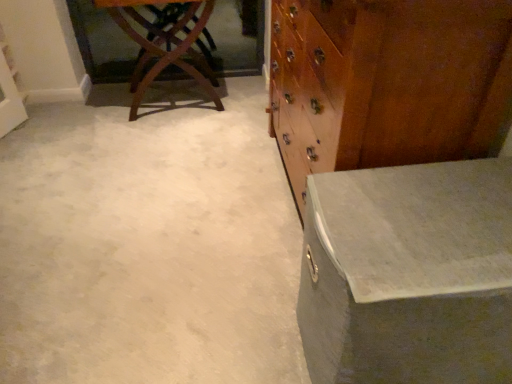
What is the approximate height of mahogany wood table at upper left, which is the first table in top-to-bottom order?

It is 68.47 centimeters.

At what (x,y) coordinates should I click in order to perform the action: click on wooden chest of drawers at right. Please return your answer as a coordinate pair (x, y). The image size is (512, 384). Looking at the image, I should click on (386, 82).

Describe the element at coordinates (148, 243) in the screenshot. I see `white concrete at center` at that location.

The width and height of the screenshot is (512, 384). What are the coordinates of `matte gray trunk at right, arranged as the 2th table when viewed from the back` in the screenshot? It's located at (408, 274).

At what (x,y) coordinates should I click in order to perform the action: click on mahogany wood table at upper left, which is the first table in top-to-bottom order. Please return your answer as a coordinate pair (x, y). Looking at the image, I should click on (162, 44).

From the image's perspective, is mahogany wood table at upper left, acting as the second table starting from the bottom, positioned above or below white concrete at center?

mahogany wood table at upper left, acting as the second table starting from the bottom, is above white concrete at center.

Is mahogany wood table at upper left, which appears as the second table when viewed from the front, next to white concrete at center?

No, mahogany wood table at upper left, which appears as the second table when viewed from the front, is not next to white concrete at center.

Is mahogany wood table at upper left, which ranks as the 1th table in left-to-right order, wider or thinner than white concrete at center?

Considering their sizes, mahogany wood table at upper left, which ranks as the 1th table in left-to-right order, looks slimmer than white concrete at center.

From a real-world perspective, is mahogany wood table at upper left, which is the first table in top-to-bottom order, over white concrete at center?

Correct, in the physical world, mahogany wood table at upper left, which is the first table in top-to-bottom order, is higher than white concrete at center.

Which object is positioned more to the left, wooden chest of drawers at right or matte gray trunk at right, arranged as the 2th table when viewed from the back?

wooden chest of drawers at right.

From their relative heights in the image, would you say wooden chest of drawers at right is taller or shorter than matte gray trunk at right, placed as the 2th table when sorted from top to bottom?

In the image, wooden chest of drawers at right appears to be taller than matte gray trunk at right, placed as the 2th table when sorted from top to bottom.

Looking at this image, can you confirm if wooden chest of drawers at right is smaller than matte gray trunk at right, arranged as the 2th table when viewed from the back?

No.

Looking at their sizes, would you say wooden chest of drawers at right is wider or thinner than matte gray trunk at right, which appears as the second table when viewed from the left?

In the image, wooden chest of drawers at right appears to be more narrow than matte gray trunk at right, which appears as the second table when viewed from the left.

Which is in front, point (428, 230) or point (189, 348)?

The point (428, 230) is closer to the camera.

From a real-world perspective, is matte gray trunk at right, arranged as the first table when ordered from the bottom, beneath white concrete at center?

Incorrect, from a real-world perspective, matte gray trunk at right, arranged as the first table when ordered from the bottom, is higher than white concrete at center.

Between matte gray trunk at right, arranged as the first table when ordered from the bottom, and white concrete at center, which one has larger width?

With larger width is white concrete at center.

Considering the relative positions of matte gray trunk at right, arranged as the 2th table when viewed from the back, and white concrete at center in the image provided, is matte gray trunk at right, arranged as the 2th table when viewed from the back, to the left of white concrete at center from the viewer's perspective?

No.

Considering the relative positions of wooden chest of drawers at right and white concrete at center in the image provided, is wooden chest of drawers at right behind white concrete at center?

No, wooden chest of drawers at right is in front of white concrete at center.

What's the angular difference between wooden chest of drawers at right and white concrete at center's facing directions?

The facing directions of wooden chest of drawers at right and white concrete at center are 90.2 degrees apart.

Consider the image. Which is nearer, (402, 138) or (284, 294)?

The point (402, 138) is closer to the camera.

From the image's perspective, which is below, wooden chest of drawers at right or white concrete at center?

From the image's view, white concrete at center is below.

Considering the sizes of matte gray trunk at right, arranged as the first table when ordered from the bottom, and mahogany wood table at upper left, the 2th table when ordered from right to left, in the image, is matte gray trunk at right, arranged as the first table when ordered from the bottom, wider or thinner than mahogany wood table at upper left, the 2th table when ordered from right to left,?

matte gray trunk at right, arranged as the first table when ordered from the bottom, is wider than mahogany wood table at upper left, the 2th table when ordered from right to left.

Do you think matte gray trunk at right, arranged as the first table when ordered from the bottom, is within mahogany wood table at upper left, which ranks as the 1th table in left-to-right order, or outside of it?

matte gray trunk at right, arranged as the first table when ordered from the bottom, is spatially situated outside mahogany wood table at upper left, which ranks as the 1th table in left-to-right order.

From the image's perspective, is matte gray trunk at right, which is the first table in front-to-back order, above or below mahogany wood table at upper left, which appears as the first table when viewed from the back?

Clearly, from the image's perspective, matte gray trunk at right, which is the first table in front-to-back order, is below mahogany wood table at upper left, which appears as the first table when viewed from the back.

Does matte gray trunk at right, which is the first table in front-to-back order, appear on the right side of wooden chest of drawers at right?

Yes, matte gray trunk at right, which is the first table in front-to-back order, is to the right of wooden chest of drawers at right.

Is matte gray trunk at right, placed as the 2th table when sorted from top to bottom, facing towards wooden chest of drawers at right?

Answer: No, matte gray trunk at right, placed as the 2th table when sorted from top to bottom, does not turn towards wooden chest of drawers at right.

Between matte gray trunk at right, which is the first table in front-to-back order, and wooden chest of drawers at right, which one has larger width?

matte gray trunk at right, which is the first table in front-to-back order.

Between matte gray trunk at right, placed as the 2th table when sorted from top to bottom, and wooden chest of drawers at right, which one has smaller size?

matte gray trunk at right, placed as the 2th table when sorted from top to bottom.

From the image's perspective, is white concrete at center located beneath mahogany wood table at upper left, which ranks as the 1th table in left-to-right order?

Yes.

Is white concrete at center oriented towards mahogany wood table at upper left, acting as the second table starting from the bottom?

No, white concrete at center is not turned towards mahogany wood table at upper left, acting as the second table starting from the bottom.

Are white concrete at center and mahogany wood table at upper left, acting as the second table starting from the bottom, far apart?

No, white concrete at center is not far away from mahogany wood table at upper left, acting as the second table starting from the bottom.

Between white concrete at center and mahogany wood table at upper left, the 2th table when ordered from right to left, which one has larger width?

white concrete at center.

Where is `table that is above the white concrete at center (from the image's perspective)`? table that is above the white concrete at center (from the image's perspective) is located at coordinates (162, 44).

Locate an element on the screen. chest of drawers that is on the left side of matte gray trunk at right, which is the first table in front-to-back order is located at coordinates (386, 82).

Considering their positions, is mahogany wood table at upper left, acting as the second table starting from the bottom, positioned further to wooden chest of drawers at right than white concrete at center?

mahogany wood table at upper left, acting as the second table starting from the bottom.

Looking at the image, which one is located further to white concrete at center, matte gray trunk at right, which appears as the second table when viewed from the left, or wooden chest of drawers at right?

wooden chest of drawers at right is further to white concrete at center.

Estimate the real-world distances between objects in this image. Which object is further from wooden chest of drawers at right, matte gray trunk at right, arranged as the 2th table when viewed from the back, or mahogany wood table at upper left, the 2th table when ordered from right to left?

mahogany wood table at upper left, the 2th table when ordered from right to left, lies further to wooden chest of drawers at right than the other object.

Based on their spatial positions, is wooden chest of drawers at right or matte gray trunk at right, which appears as the second table when viewed from the left, closer to white concrete at center?

matte gray trunk at right, which appears as the second table when viewed from the left, is closer to white concrete at center.

When comparing their distances from matte gray trunk at right, the 1th table from the right, does wooden chest of drawers at right or mahogany wood table at upper left, acting as the second table starting from the bottom, seem closer?

Among the two, wooden chest of drawers at right is located nearer to matte gray trunk at right, the 1th table from the right.

Looking at the image, which one is located closer to mahogany wood table at upper left, which appears as the first table when viewed from the back, wooden chest of drawers at right or white concrete at center?

The object closer to mahogany wood table at upper left, which appears as the first table when viewed from the back, is white concrete at center.

Which object lies nearer to the anchor point matte gray trunk at right, which appears as the second table when viewed from the left, white concrete at center or wooden chest of drawers at right?

wooden chest of drawers at right is positioned closer to the anchor matte gray trunk at right, which appears as the second table when viewed from the left.

Considering their positions, is mahogany wood table at upper left, which appears as the first table when viewed from the back, positioned closer to white concrete at center than wooden chest of drawers at right?

The object closer to white concrete at center is wooden chest of drawers at right.

The height and width of the screenshot is (384, 512). Identify the location of chest of drawers between matte gray trunk at right, arranged as the first table when ordered from the bottom, and mahogany wood table at upper left, acting as the second table starting from the bottom, along the z-axis. (386, 82).

This screenshot has width=512, height=384. Find the location of `concrete between matte gray trunk at right, which appears as the second table when viewed from the left, and mahogany wood table at upper left, which ranks as the 1th table in left-to-right order, from front to back`. concrete between matte gray trunk at right, which appears as the second table when viewed from the left, and mahogany wood table at upper left, which ranks as the 1th table in left-to-right order, from front to back is located at coordinates [x=148, y=243].

In order to click on the chest of drawers situated between white concrete at center and matte gray trunk at right, arranged as the 2th table when viewed from the back, from left to right in this screenshot , I will do `click(386, 82)`.

The width and height of the screenshot is (512, 384). What are the coordinates of `concrete positioned between wooden chest of drawers at right and mahogany wood table at upper left, which appears as the first table when viewed from the back, from near to far` in the screenshot? It's located at pos(148,243).